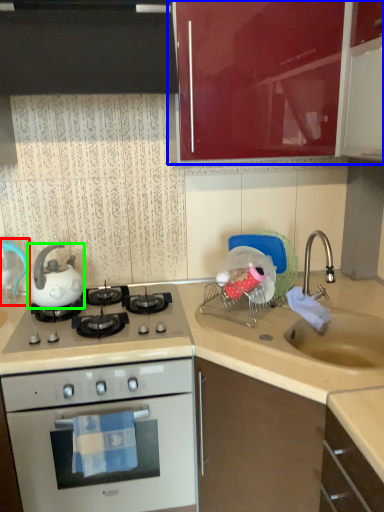
Question: Which object is the closest to the kitchen appliance (highlighted by a red box)? Choose among these: cabinetry (highlighted by a blue box) or tea pot (highlighted by a green box).

Choices:
 (A) cabinetry
 (B) tea pot

Answer: (B)